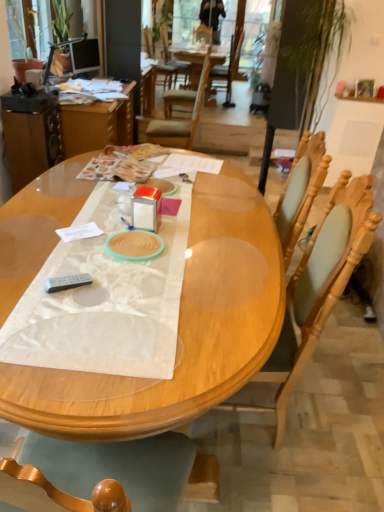
Question: Considering the relative positions of white satin table runner at center and wooden table at left in the image provided, is white satin table runner at center to the left or to the right of wooden table at left?

Choices:
 (A) left
 (B) right

Answer: (B)

Question: Considering the positions of point (49, 365) and point (76, 123), is point (49, 365) closer or farther from the camera than point (76, 123)?

Choices:
 (A) farther
 (B) closer

Answer: (B)

Question: Based on their relative distances, which object is nearer to the gray matte remote control at lower left?

Choices:
 (A) wooden table at left
 (B) wooden chair at center, which is the second chair from bottom to top
 (C) wooden chair at right, placed as the first chair when sorted from bottom to top
 (D) wooden table at center
 (E) green leafy plant at upper left, which is counted as the 1th houseplant, starting from the front

Answer: (D)

Question: Considering the real-world distances, which object is closest to the gray matte remote control at lower left?

Choices:
 (A) wooden table at center
 (B) matte black monitor at upper left
 (C) green leafy plant at upper left, arranged as the first houseplant when viewed from the back
 (D) wooden chair at center, which is the second chair from bottom to top
 (E) wooden table at left

Answer: (A)